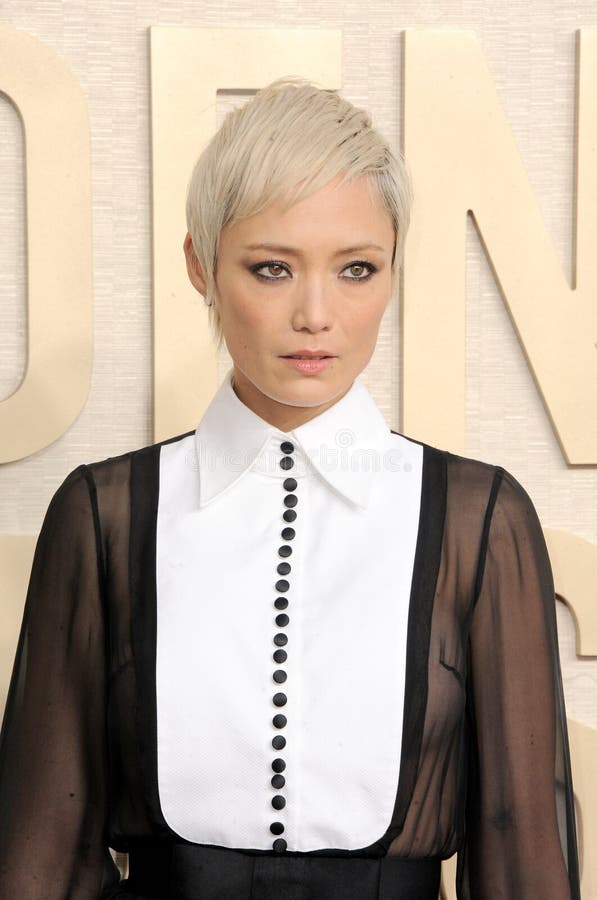
In order to click on wall in this screenshot , I will do `click(120, 405)`.